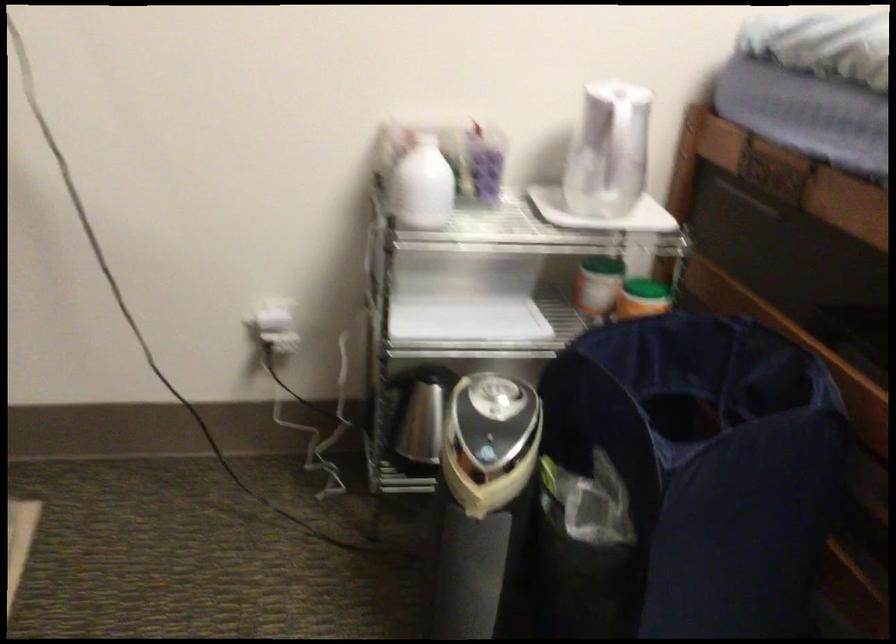
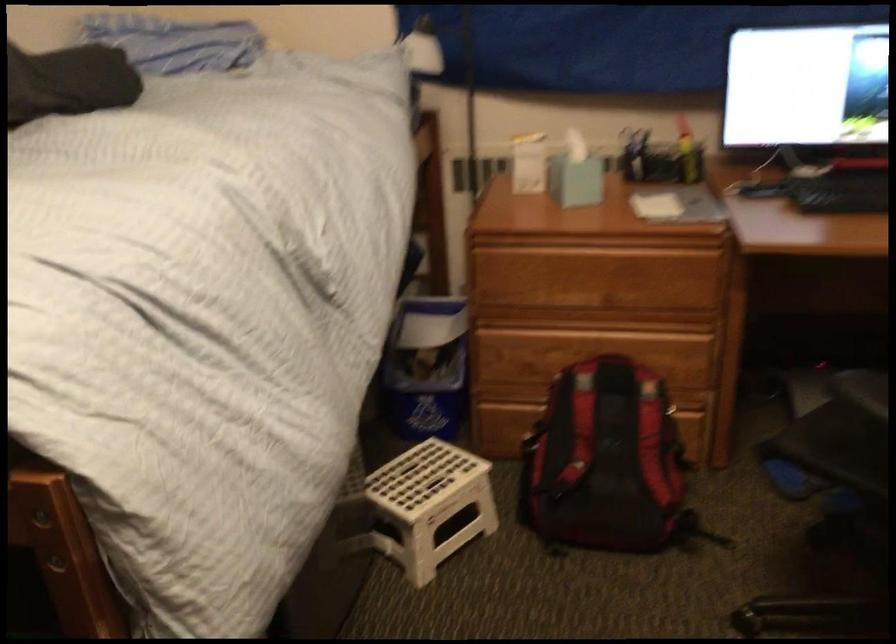
First-person continuous shooting, in which direction is the camera rotating?

The rotation direction of the camera is right-down.